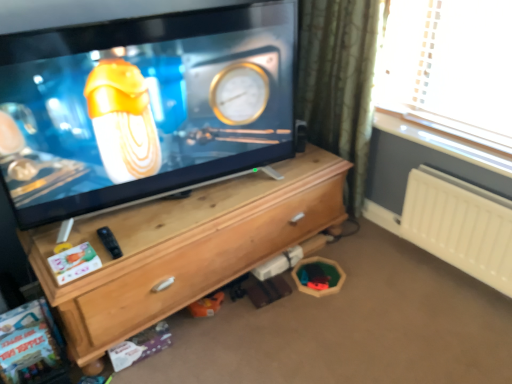
Image resolution: width=512 pixels, height=384 pixels. In order to click on free spot above white plastic radiator at right (from a real-world perspective) in this screenshot , I will do `click(465, 189)`.